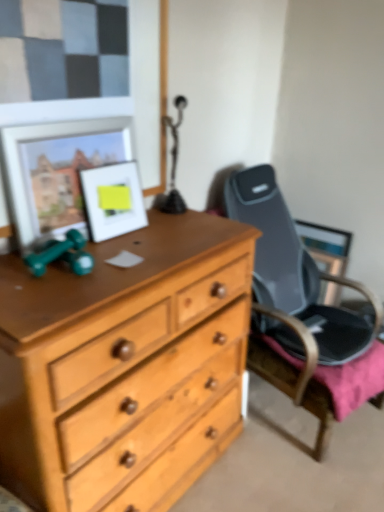
This screenshot has height=512, width=384. Identify the location of vacant region above matte silver picture frame at upper left, the second picture frame when ordered from right to left (from a real-world perspective). (67, 117).